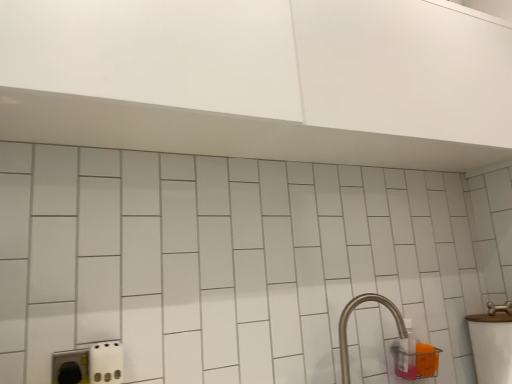
Image resolution: width=512 pixels, height=384 pixels. What are the coordinates of `satin nickel faucet at lower right` in the screenshot? It's located at (347, 322).

Identify the location of white glossy sink at right. The image size is (512, 384). (492, 343).

This screenshot has height=384, width=512. I want to click on translucent plastic bottle at lower right, so click(x=406, y=354).

From the image's perspective, which is below, translucent plastic bottle at lower right or satin nickel faucet at lower right?

translucent plastic bottle at lower right appears lower in the image.

Locate an element on the screen. The image size is (512, 384). tap located on the left of translucent plastic bottle at lower right is located at coordinates (347, 322).

From their relative heights in the image, would you say translucent plastic bottle at lower right is taller or shorter than satin nickel faucet at lower right?

translucent plastic bottle at lower right is shorter than satin nickel faucet at lower right.

Consider the image. Which is more to the right, translucent plastic bottle at lower right or satin nickel faucet at lower right?

translucent plastic bottle at lower right is more to the right.

Considering the positions of points (503, 313) and (393, 316), is point (503, 313) farther from camera compared to point (393, 316)?

That is False.

Considering the sizes of objects white glossy sink at right and satin nickel faucet at lower right in the image provided, who is wider, white glossy sink at right or satin nickel faucet at lower right?

white glossy sink at right.

Between white glossy sink at right and satin nickel faucet at lower right, which one appears on the right side from the viewer's perspective?

white glossy sink at right.

Where is `bottle on the left of white glossy sink at right`? The height and width of the screenshot is (384, 512). bottle on the left of white glossy sink at right is located at coordinates (406, 354).

Does point (405, 325) come closer to viewer compared to point (485, 339)?

Yes, point (405, 325) is in front of point (485, 339).

Does translucent plastic bottle at lower right have a lesser height compared to white glossy sink at right?

Yes.

Between translucent plastic bottle at lower right and white glossy sink at right, which one appears on the right side from the viewer's perspective?

white glossy sink at right.

From the image's perspective, which is below, satin nickel faucet at lower right or translucent plastic bottle at lower right?

translucent plastic bottle at lower right.

Do you think satin nickel faucet at lower right is within translucent plastic bottle at lower right, or outside of it?

satin nickel faucet at lower right is spatially situated outside translucent plastic bottle at lower right.

Is satin nickel faucet at lower right directly adjacent to translucent plastic bottle at lower right?

There is a gap between satin nickel faucet at lower right and translucent plastic bottle at lower right.

Is satin nickel faucet at lower right positioned with its back to white glossy sink at right?

satin nickel faucet at lower right is not turned away from white glossy sink at right.

How different are the orientations of satin nickel faucet at lower right and white glossy sink at right in degrees?

The facing directions of satin nickel faucet at lower right and white glossy sink at right are 0.155 degrees apart.

From the image's perspective, is satin nickel faucet at lower right located above white glossy sink at right?

Yes, from the image's perspective, satin nickel faucet at lower right is over white glossy sink at right.

Looking at this image, is satin nickel faucet at lower right further to camera compared to white glossy sink at right?

No, it is in front of white glossy sink at right.

Is point (479, 322) closer or farther from the camera than point (395, 370)?

Point (479, 322) is farther from the camera than point (395, 370).

Looking at this image, can you confirm if white glossy sink at right is thinner than translucent plastic bottle at lower right?

Incorrect, the width of white glossy sink at right is not less than that of translucent plastic bottle at lower right.

Which object is further away from the camera, white glossy sink at right or translucent plastic bottle at lower right?

translucent plastic bottle at lower right.

Find the location of a particular element. bottle that is behind the satin nickel faucet at lower right is located at coordinates (406, 354).

The width and height of the screenshot is (512, 384). I want to click on tap above the white glossy sink at right (from a real-world perspective), so click(x=347, y=322).

When comparing their distances from satin nickel faucet at lower right, does white glossy sink at right or translucent plastic bottle at lower right seem closer?

Based on the image, translucent plastic bottle at lower right appears to be nearer to satin nickel faucet at lower right.

Considering their positions, is satin nickel faucet at lower right positioned further to translucent plastic bottle at lower right than white glossy sink at right?

The object further to translucent plastic bottle at lower right is white glossy sink at right.

Looking at the image, which one is located closer to white glossy sink at right, translucent plastic bottle at lower right or satin nickel faucet at lower right?

Based on the image, translucent plastic bottle at lower right appears to be nearer to white glossy sink at right.

Considering their positions, is satin nickel faucet at lower right positioned closer to white glossy sink at right than translucent plastic bottle at lower right?

translucent plastic bottle at lower right lies closer to white glossy sink at right than the other object.

From the image, which object appears to be nearer to satin nickel faucet at lower right, translucent plastic bottle at lower right or white glossy sink at right?

Based on the image, translucent plastic bottle at lower right appears to be nearer to satin nickel faucet at lower right.

Estimate the real-world distances between objects in this image. Which object is further from translucent plastic bottle at lower right, white glossy sink at right or satin nickel faucet at lower right?

white glossy sink at right is positioned further to the anchor translucent plastic bottle at lower right.

The height and width of the screenshot is (384, 512). Find the location of `bottle between satin nickel faucet at lower right and white glossy sink at right from left to right`. bottle between satin nickel faucet at lower right and white glossy sink at right from left to right is located at coordinates (406, 354).